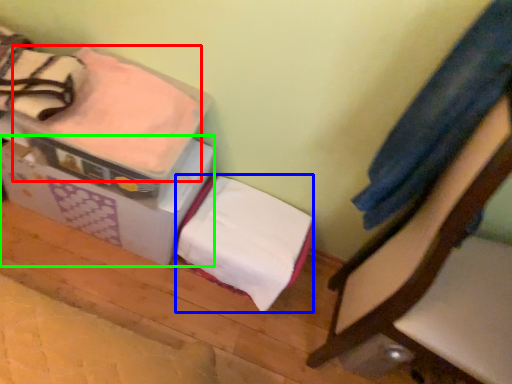
Question: Considering the real-world distances, which object is closest to blanket (highlighted by a red box)? blanket (highlighted by a blue box) or cardboard box (highlighted by a green box).

Choices:
 (A) blanket
 (B) cardboard box

Answer: (B)